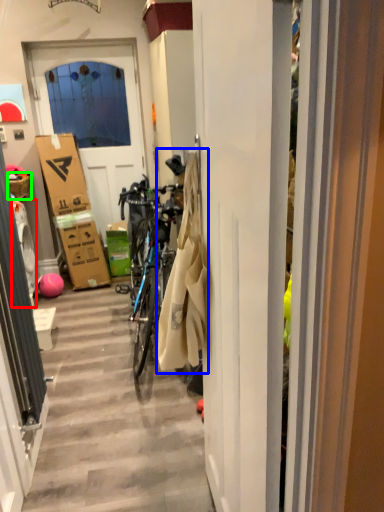
Question: Based on their relative distances, which object is farther from washing machine (highlighted by a red box)? Choose from laundry (highlighted by a blue box) and picnic basket (highlighted by a green box).

Choices:
 (A) laundry
 (B) picnic basket

Answer: (A)